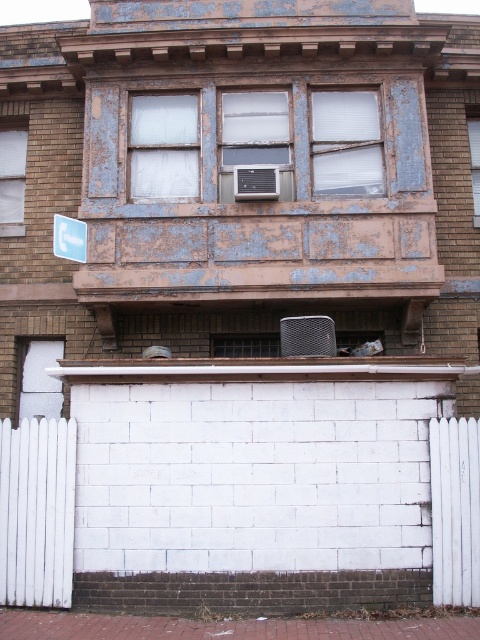
Which of these two, white matte door at lower left or clear glass window at center, stands taller?

white matte door at lower left

Can you confirm if white matte door at lower left is positioned to the right of clear glass window at center?

In fact, white matte door at lower left is to the left of clear glass window at center.

Where is `white matte door at lower left`? white matte door at lower left is located at coordinates tap(40, 380).

Is white matte window at left taller than clear glass window at center?

Correct, white matte window at left is much taller as clear glass window at center.

Between point (2, 188) and point (218, 352), which one is positioned in front?

Point (218, 352)

Where is `white matte window at left`? This screenshot has height=640, width=480. white matte window at left is located at coordinates (12, 180).

Which is below, white plastic air conditioner at center or clear glass window at upper center?

Positioned lower is clear glass window at upper center.

Find the location of `white plastic air conditioner at center`. white plastic air conditioner at center is located at coordinates (254, 136).

Is point (282, 129) closer to viewer compared to point (470, 120)?

Yes, point (282, 129) is closer to viewer.

Where is `white plastic air conditioner at center`? The image size is (480, 640). white plastic air conditioner at center is located at coordinates (254, 136).